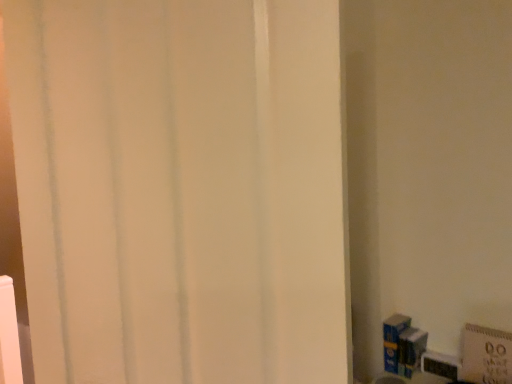
The height and width of the screenshot is (384, 512). I want to click on white matte curtain at center, so click(181, 189).

The image size is (512, 384). What do you see at coordinates (181, 189) in the screenshot?
I see `white matte curtain at center` at bounding box center [181, 189].

Find the location of a particular element. white matte curtain at center is located at coordinates (181, 189).